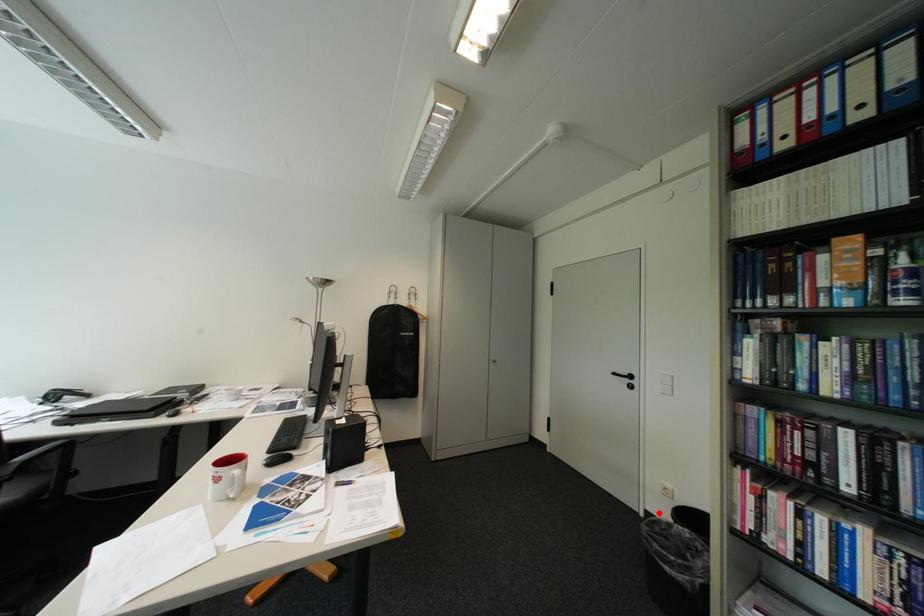
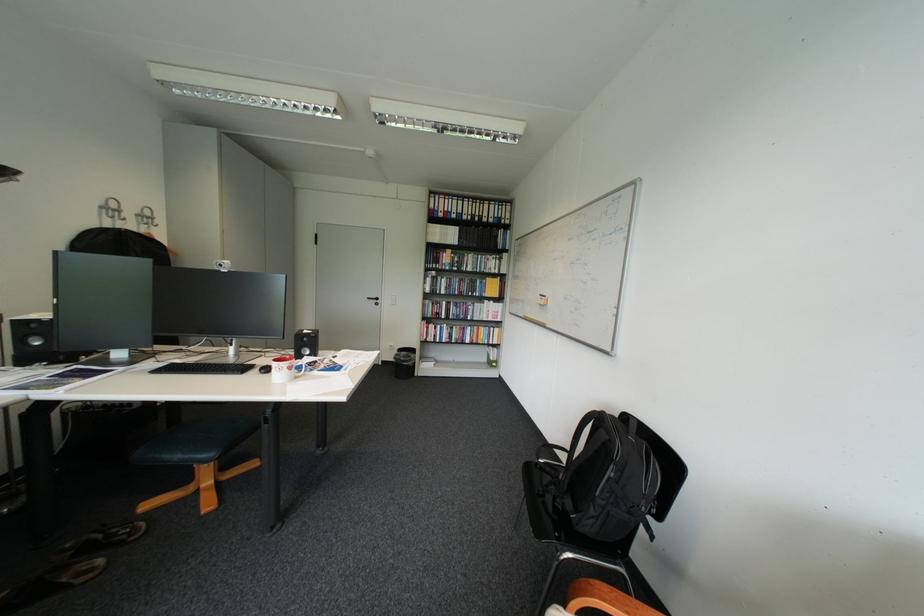
Question: I am providing you with two images of the same scene from different viewpoints. A red point is shown in image1. For the corresponding object point in image2, is it positioned nearer or farther from the camera?

Choices:
 (A) Nearer
 (B) Farther

Answer: (B)